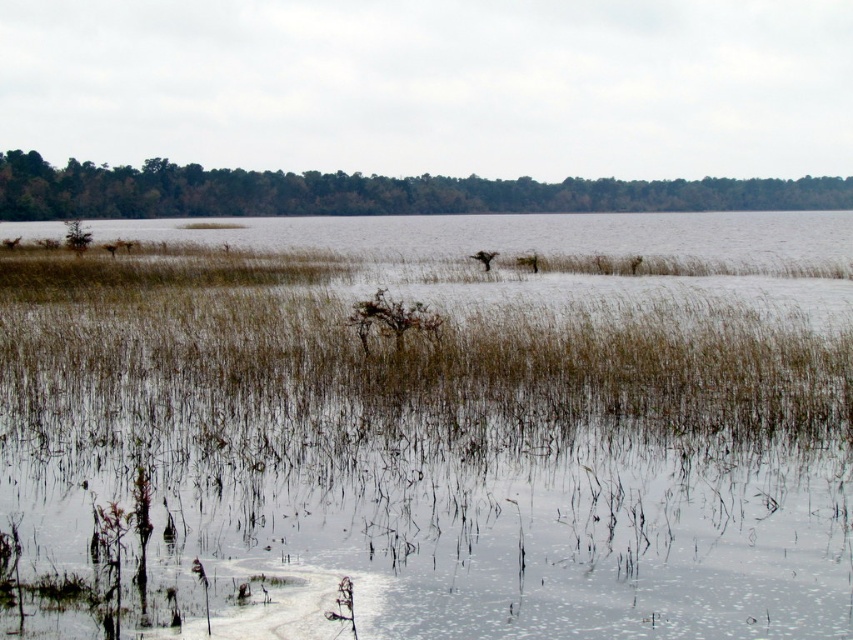
Question: Can you confirm if brown dry grass at center is bigger than green matte trees at upper center?

Choices:
 (A) yes
 (B) no

Answer: (B)

Question: Considering the relative positions of brown dry grass at center and green matte trees at upper center in the image provided, where is brown dry grass at center located with respect to green matte trees at upper center?

Choices:
 (A) left
 (B) right

Answer: (A)

Question: Among these points, which one is nearest to the camera?

Choices:
 (A) (387, 182)
 (B) (508, 337)

Answer: (B)

Question: Is brown dry grass at center closer to the viewer compared to green matte trees at upper center?

Choices:
 (A) yes
 (B) no

Answer: (A)